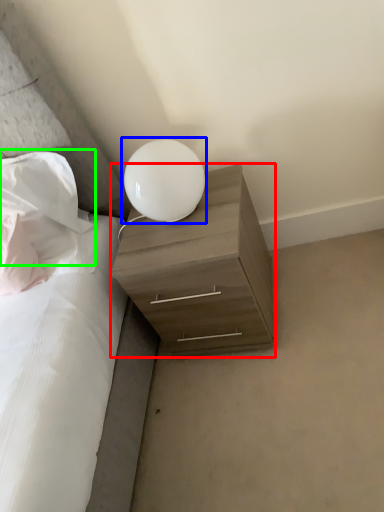
Question: Estimate the real-world distances between objects in this image. Which object is farther from nightstand (highlighted by a red box), lamp (highlighted by a blue box) or pillow (highlighted by a green box)?

Choices:
 (A) lamp
 (B) pillow

Answer: (B)